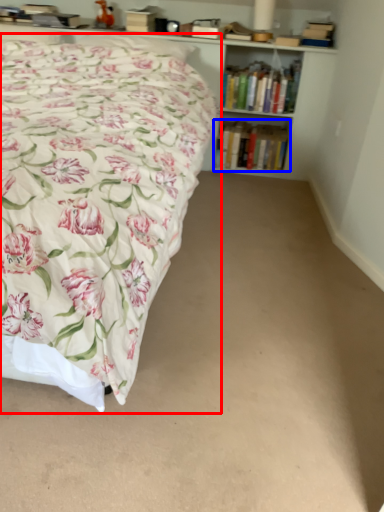
Question: Which of the following is the closest to the observer, bed (highlighted by a red box) or book (highlighted by a blue box)?

Choices:
 (A) bed
 (B) book

Answer: (A)